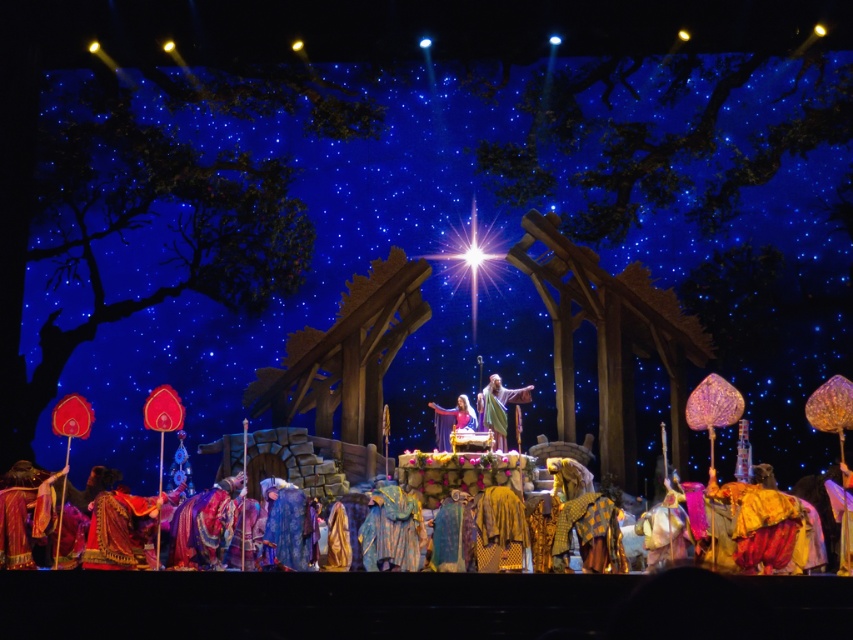
You are standing in the nativity scene and want to take a photo of the point at coordinate (155,497). The camera you are using has a maximum focus range of 70 meters. Will the camera be able to focus on the point?

The point at coordinate (155,497) is 75.99 meters from the camera, which exceeds the camera maximum focus range of 70 meters. Therefore, the camera will not be able to focus on the point.

You are an actor in the nativity play and need to hand a prop to the figure wearing the velvet red robe at lower left and the smooth golden robe at center. Which robe should you approach first to ensure you can reach them without moving too far from your current position?

You should approach the velvet red robe at lower left first because it is closer to you than the smooth golden robe at center.